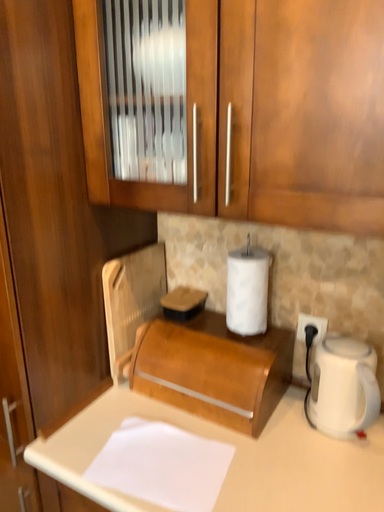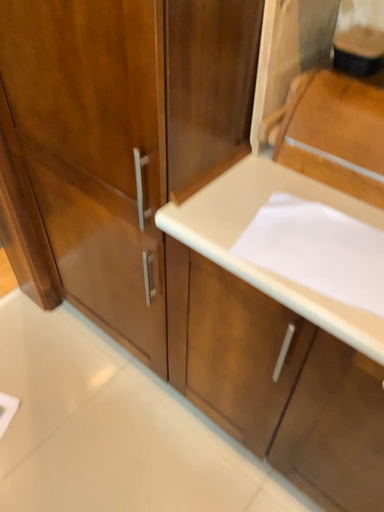
Question: Which way did the camera rotate in the video?

Choices:
 (A) rotated right
 (B) rotated left

Answer: (B)